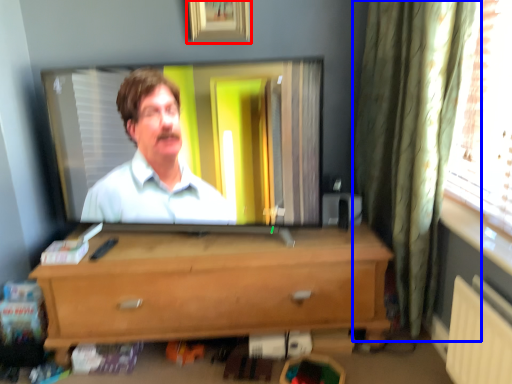
Question: Which object appears closest to the camera in this image, picture frame (highlighted by a red box) or curtain (highlighted by a blue box)?

Choices:
 (A) picture frame
 (B) curtain

Answer: (B)